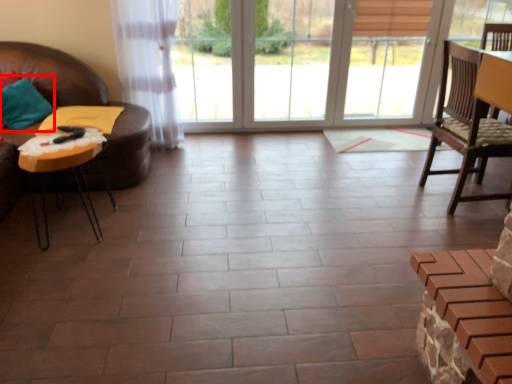
Question: From the image's perspective, where is pillow (annotated by the red box) located relative to table?

Choices:
 (A) below
 (B) above

Answer: (B)